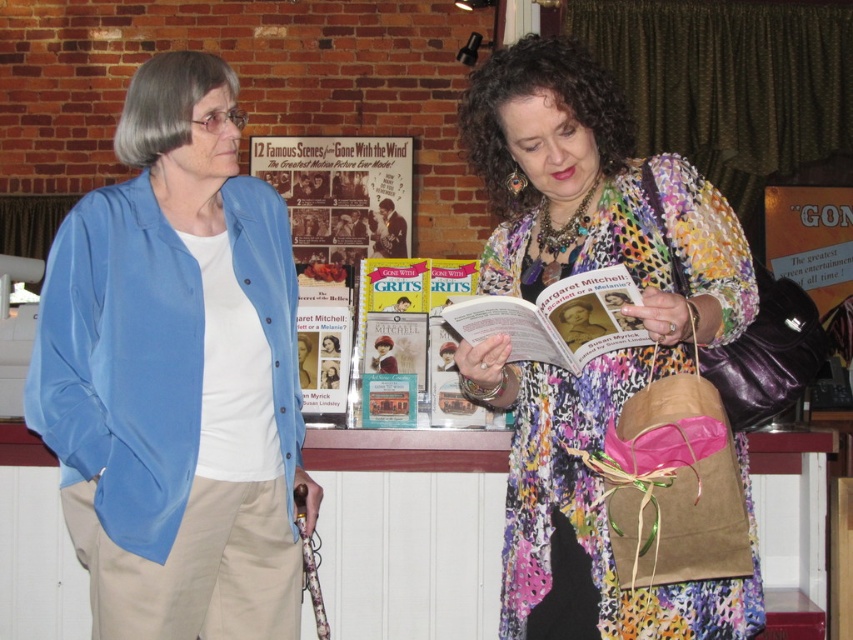
Between floral silk dress at center and matte paper magazine at center, which one appears on the left side from the viewer's perspective?

From the viewer's perspective, matte paper magazine at center appears more on the left side.

Is point (683, 262) positioned in front of point (527, 353)?

Yes, it is in front of point (527, 353).

Is point (515, 432) positioned after point (563, 364)?

That is True.

This screenshot has width=853, height=640. Identify the location of floral silk dress at center. (602, 355).

Who is positioned more to the right, matte paper poster at center or matte paper magazine at center?

matte paper magazine at center is more to the right.

Is matte paper poster at center smaller than matte paper magazine at center?

No.

Which is behind, point (334, 164) or point (543, 356)?

The point (334, 164) is more distant.

The width and height of the screenshot is (853, 640). Identify the location of matte paper poster at center. (340, 193).

Can you confirm if floral silk dress at center is positioned below hardcover book at center?

No, floral silk dress at center is not below hardcover book at center.

Is floral silk dress at center thinner than hardcover book at center?

In fact, floral silk dress at center might be wider than hardcover book at center.

Who is more forward, (509, 177) or (444, 412)?

Point (509, 177) is more forward.

Identify the location of floral silk dress at center. This screenshot has height=640, width=853. (602, 355).